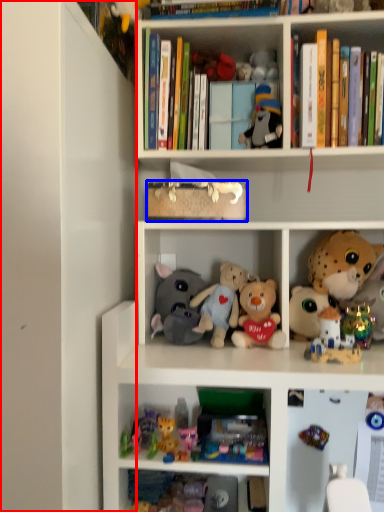
Question: Among these objects, which one is farthest to the camera, side (highlighted by a red box) or book (highlighted by a blue box)?

Choices:
 (A) side
 (B) book

Answer: (B)